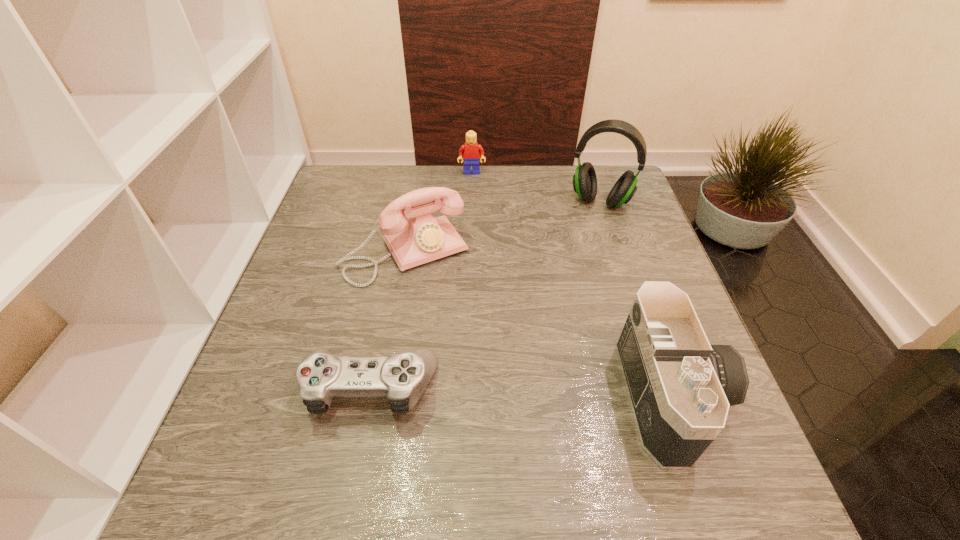
At what (x,y) coordinates should I click in order to perform the action: click on vacant space at the left edge of the desktop. Please return your answer as a coordinate pair (x, y). The image size is (960, 540). Looking at the image, I should click on (316, 259).

This screenshot has height=540, width=960. What are the coordinates of `free location at the far left corner` in the screenshot? It's located at pos(340,200).

In the image, there is a desktop. Identify the location of vacant space at the far right corner. The width and height of the screenshot is (960, 540). (596, 174).

This screenshot has height=540, width=960. I want to click on vacant space that's between the shortest object and the headset, so click(485, 294).

Where is `free space between the shortest object and the farthest object`? This screenshot has width=960, height=540. free space between the shortest object and the farthest object is located at coordinates (421, 280).

Where is `free space between the camera and the third farthest object`? free space between the camera and the third farthest object is located at coordinates (540, 323).

I want to click on free area in between the third nearest object and the shortest object, so click(x=388, y=320).

Identify the location of unoccupied position between the camera and the third nearest object. This screenshot has width=960, height=540. (540, 323).

In order to click on empty space that is in between the Lego and the shortest object in this screenshot , I will do `click(421, 280)`.

You are a GUI agent. You are given a task and a screenshot of the screen. Output one action in this format:
    pyautogui.click(x=<x>, y=<y>)
    Task: Click on the vacant area that lies between the fourth nearest object and the second shortest object
    Image resolution: width=960 pixels, height=540 pixels.
    Given the screenshot: What is the action you would take?
    pyautogui.click(x=536, y=187)